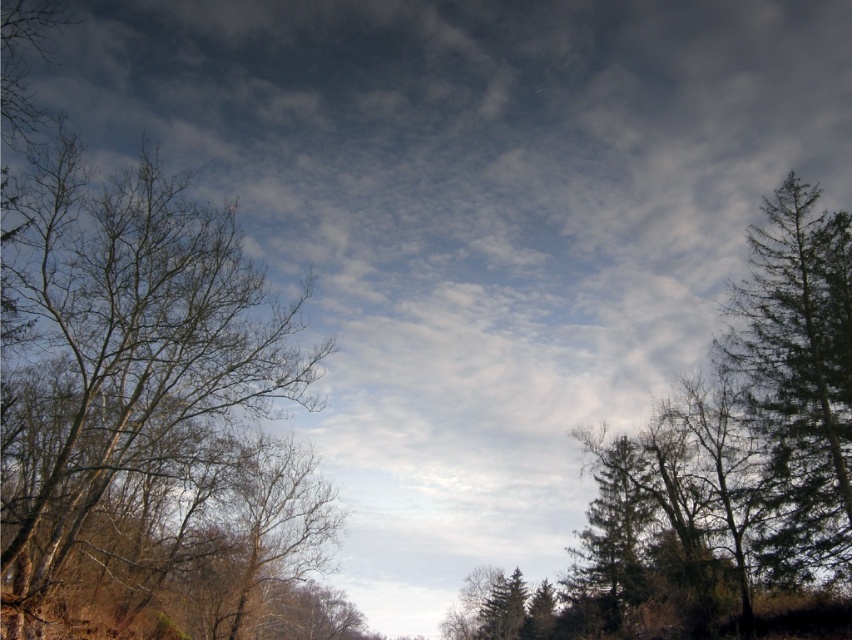
Question: Which point is closer to the camera?

Choices:
 (A) (217, 320)
 (B) (827, 396)

Answer: (A)

Question: Which object is closer to the camera taking this photo?

Choices:
 (A) green textured tree at right
 (B) brown leafless tree at left

Answer: (B)

Question: Which point appears closest to the camera in this image?

Choices:
 (A) (32, 531)
 (B) (816, 499)

Answer: (A)

Question: Is brown leafless tree at left thinner than green textured tree at right?

Choices:
 (A) yes
 (B) no

Answer: (B)

Question: Considering the relative positions of brown leafless tree at left and green textured tree at right in the image provided, where is brown leafless tree at left located with respect to green textured tree at right?

Choices:
 (A) left
 (B) right

Answer: (A)

Question: Can you confirm if brown leafless tree at left is thinner than green textured tree at right?

Choices:
 (A) no
 (B) yes

Answer: (A)